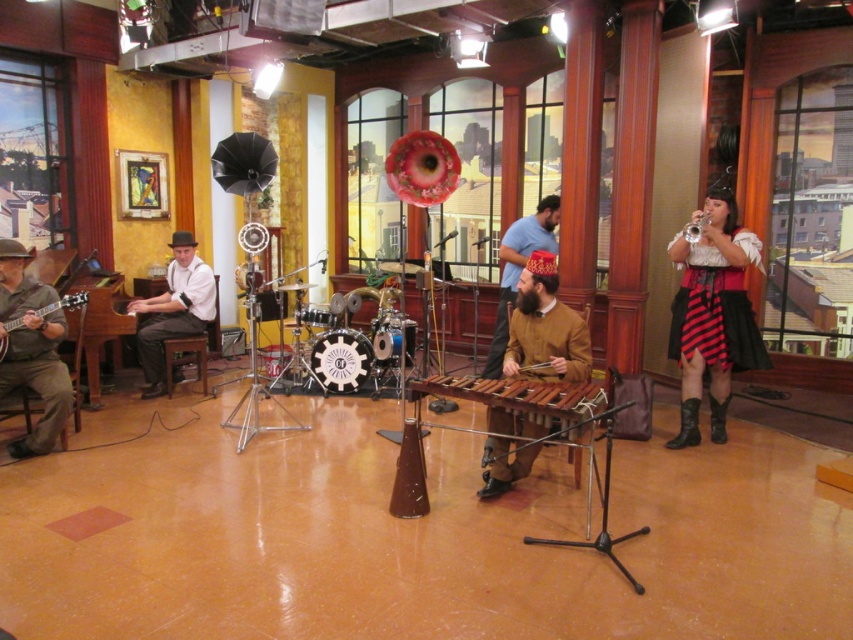
You are a photographer setting up a shoot in the studio. You need to position a light source between the brown leather jacket at center and the matte white shirt at left. Which side of the light should be closer to the narrower object?

The brown leather jacket at center is narrower than the matte white shirt at left, so the light source should be placed closer to the brown leather jacket at center to ensure proper illumination.